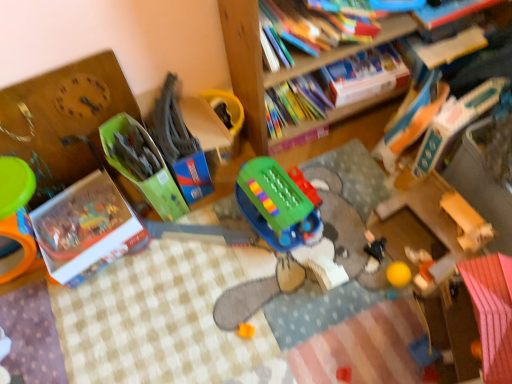
This screenshot has height=384, width=512. I want to click on space that is in front of rubberized orange ball at lower right, which is the first toy in right-to-left order, so click(413, 327).